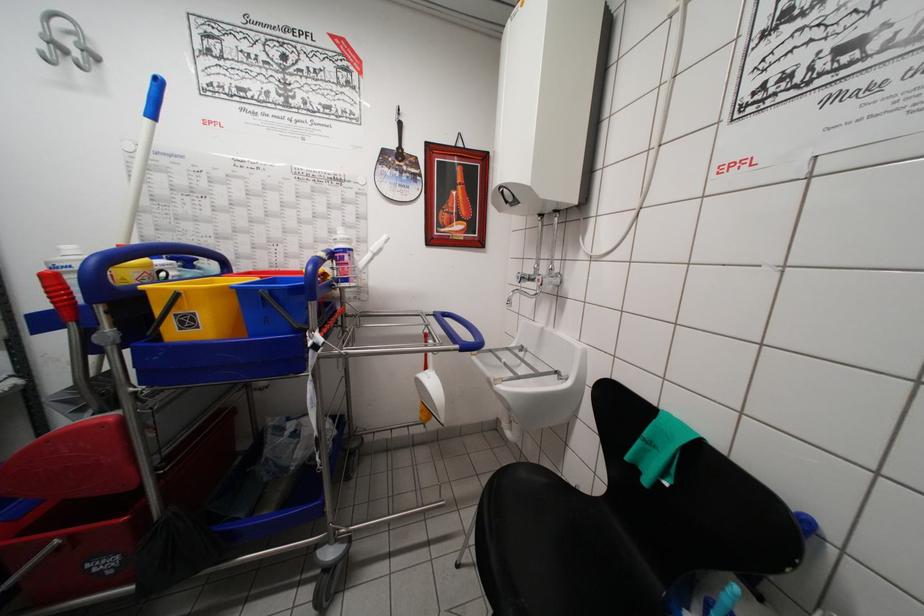
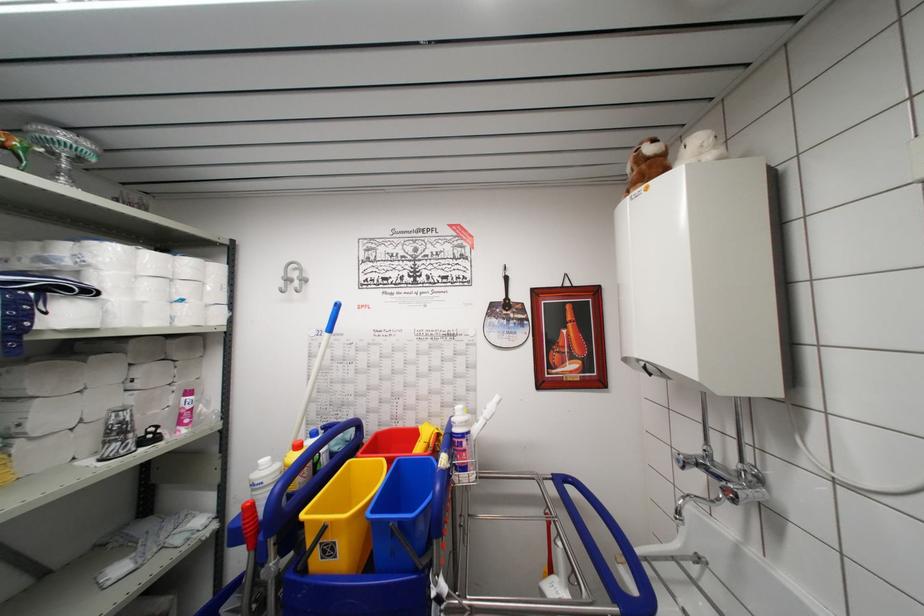
In the second image, find the point that corresponds to pixel 404 163 in the first image.

(511, 313)